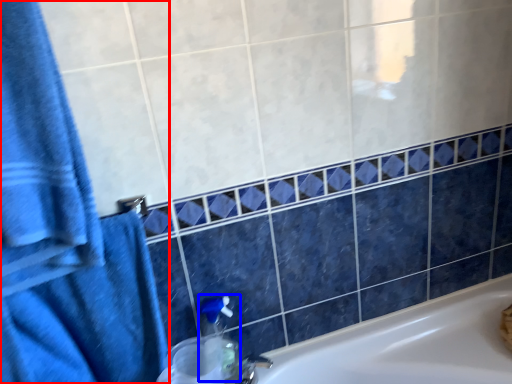
Question: Which object appears farthest to the camera in this image, bath towel (highlighted by a red box) or soap dispenser (highlighted by a blue box)?

Choices:
 (A) bath towel
 (B) soap dispenser

Answer: (B)